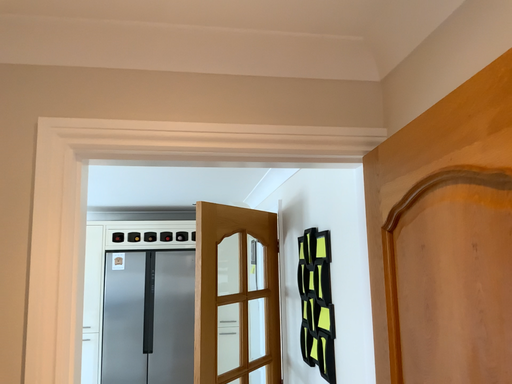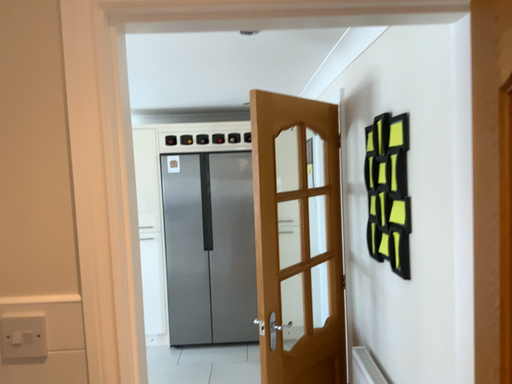
Question: Which way did the camera rotate in the video?

Choices:
 (A) rotated right
 (B) rotated left

Answer: (B)